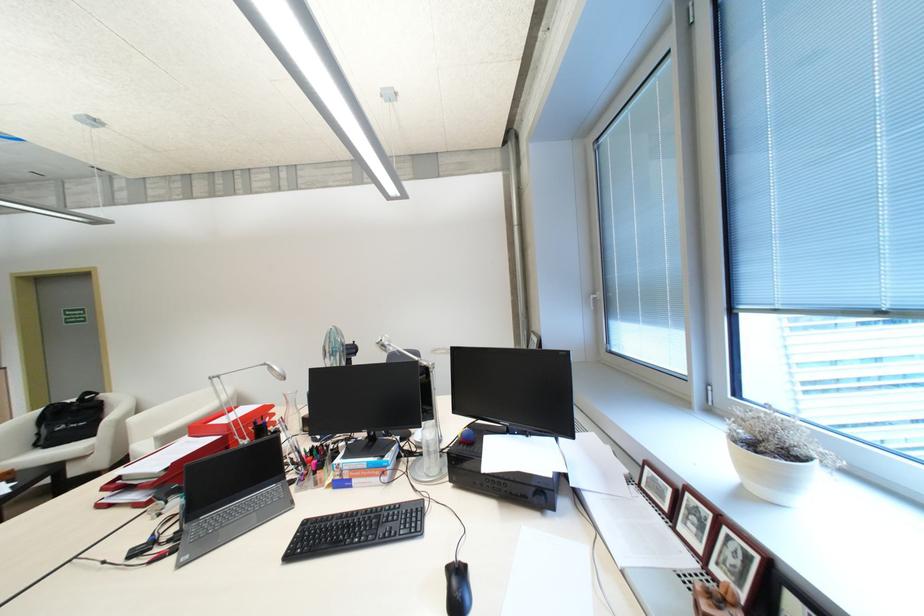
Find where to lift the red paper tray. Please return your answer as a coordinate pair (x, y).

(229, 421)